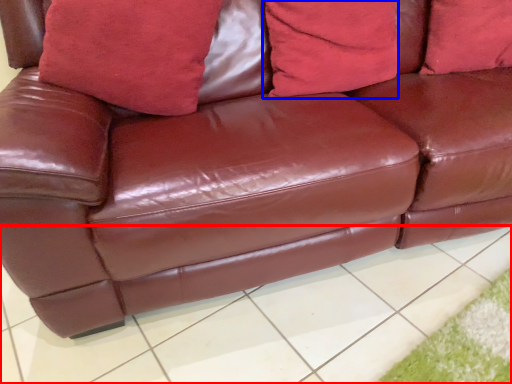
Question: Among these objects, which one is farthest to the camera, tile (highlighted by a red box) or pillow (highlighted by a blue box)?

Choices:
 (A) tile
 (B) pillow

Answer: (B)